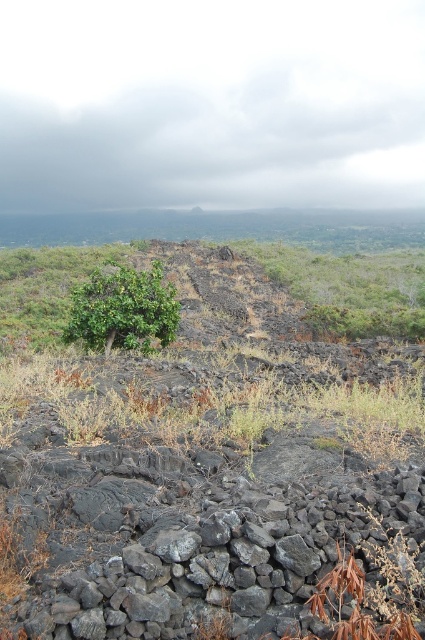
Based on the photo, you are navigating through this volcanic landscape and need to reach a specific location. You have two reference points marked as point (235, 602) and point (93, 288). Which point should you head towards first if you want to reach the one that is closer to your current position?

Point (235, 602) is in front of point (93, 288), so you should head towards point (235, 602) first as it is closer to your current position.

You are a hiker who wants to place a small flag at the highest point between the dull gray rock at center and the green leafy shrub at center. Which object should you choose to place the flag on?

The dull gray rock at center has a greater height compared to the green leafy shrub at center, so you should place the flag on the dull gray rock at center.